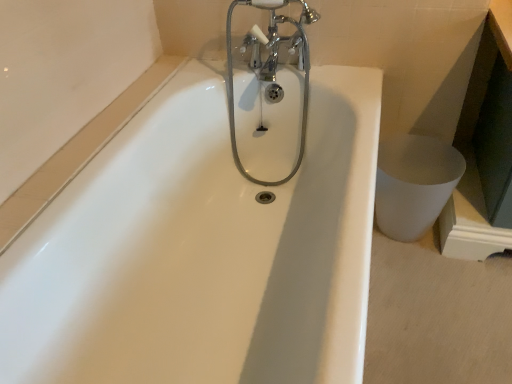
Question: Considering the positions of white glossy toilet bowl at lower right and chrome metallic faucet at upper center in the image, is white glossy toilet bowl at lower right bigger or smaller than chrome metallic faucet at upper center?

Choices:
 (A) small
 (B) big

Answer: (A)

Question: From a real-world perspective, relative to chrome metallic faucet at upper center, is white glossy toilet bowl at lower right vertically above or below?

Choices:
 (A) above
 (B) below

Answer: (B)

Question: From the image's perspective, is white glossy toilet bowl at lower right positioned above or below chrome metallic faucet at upper center?

Choices:
 (A) below
 (B) above

Answer: (A)

Question: In terms of height, does chrome metallic faucet at upper center look taller or shorter compared to white glossy toilet bowl at lower right?

Choices:
 (A) tall
 (B) short

Answer: (A)

Question: Is point (284, 18) positioned closer to the camera than point (402, 230)?

Choices:
 (A) closer
 (B) farther

Answer: (A)

Question: Is chrome metallic faucet at upper center to the left or to the right of white glossy toilet bowl at lower right in the image?

Choices:
 (A) left
 (B) right

Answer: (A)

Question: In the image, is chrome metallic faucet at upper center positioned in front of or behind white glossy toilet bowl at lower right?

Choices:
 (A) behind
 (B) front

Answer: (B)